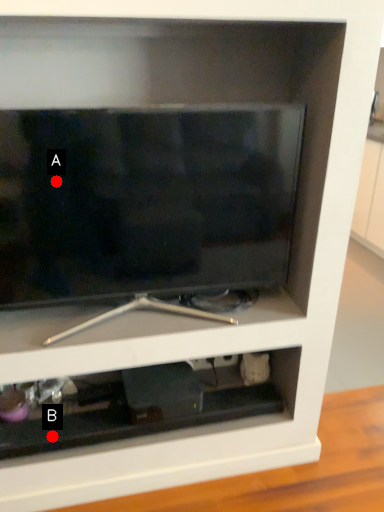
Question: Two points are circled on the image, labeled by A and B beside each circle. Among these points, which one is farthest from the camera?

Choices:
 (A) A is further
 (B) B is further

Answer: (B)